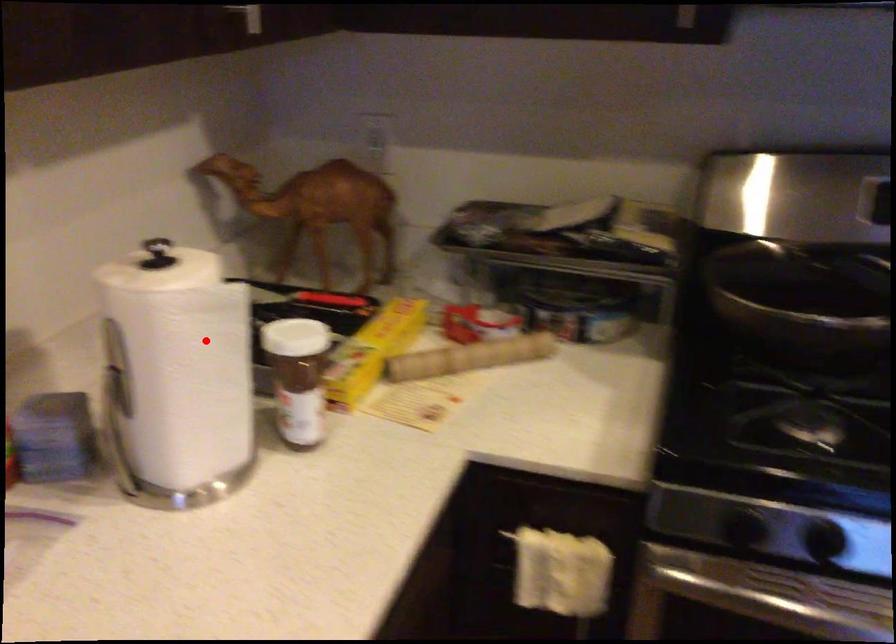
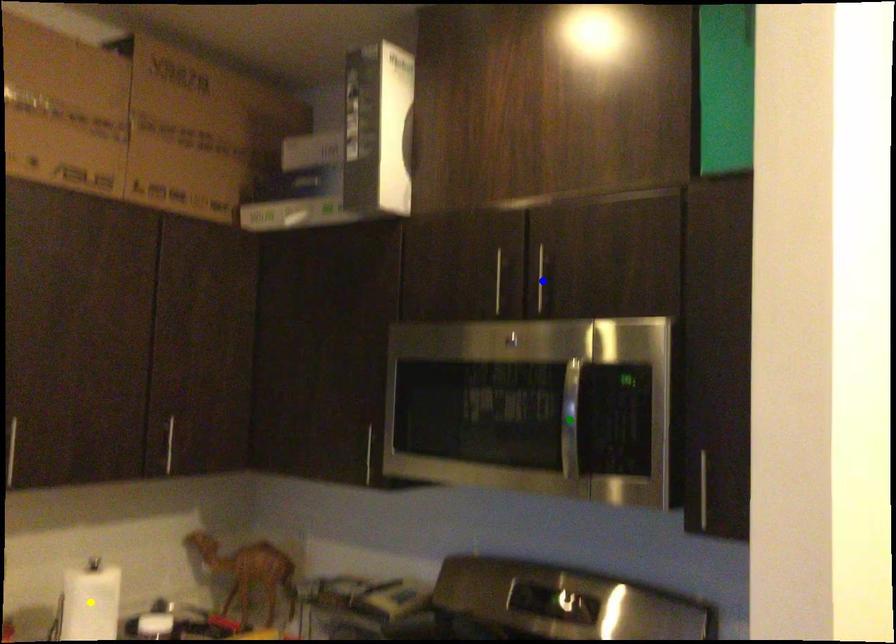
Question: I am providing you with two images of the same scene from different viewpoints. A red point is marked on the first image. You are given multiple points on the second image. Which mark in image 2 goes with the point in image 1?

Choices:
 (A) green point
 (B) yellow point
 (C) blue point

Answer: (B)